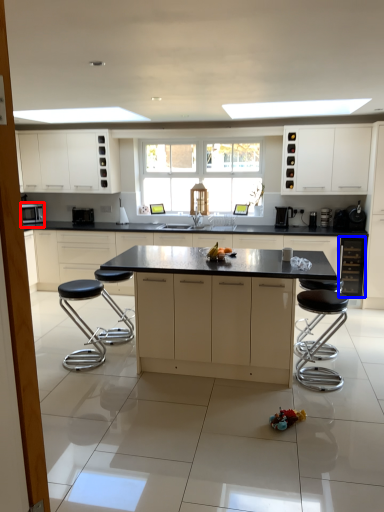
Question: Which object is further to the camera taking this photo, appliance (highlighted by a red box) or cabinetry (highlighted by a blue box)?

Choices:
 (A) appliance
 (B) cabinetry

Answer: (A)